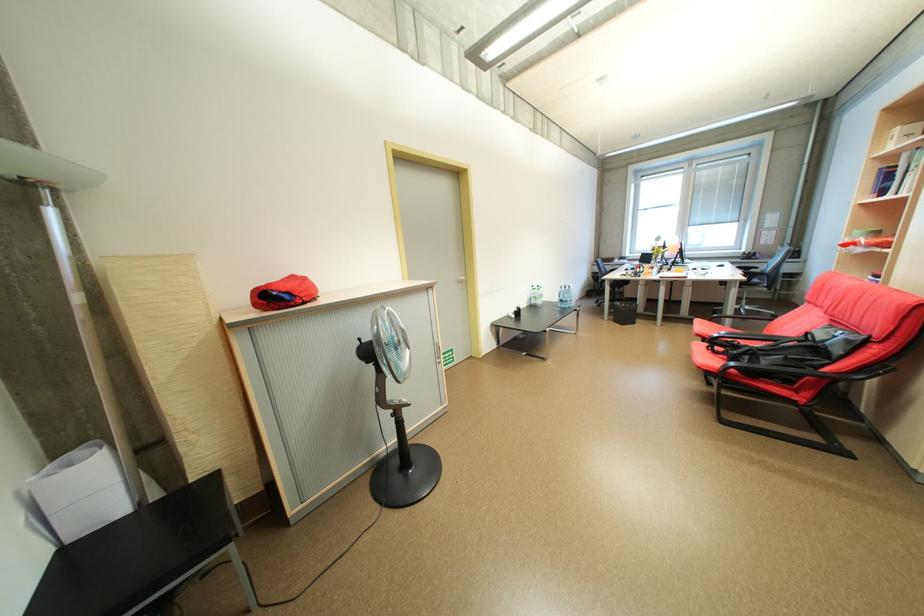
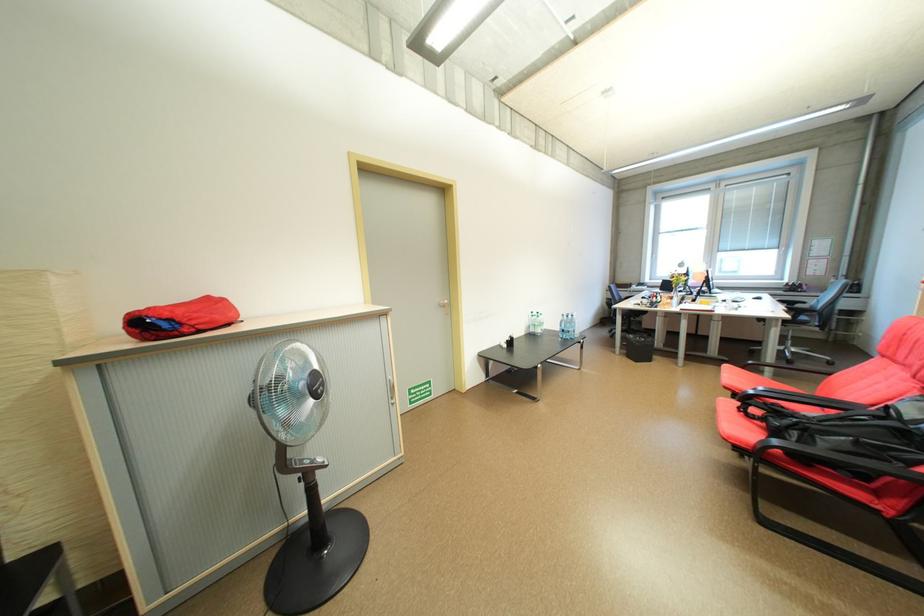
In the second image, find the point that corresponds to [541,302] in the first image.

(541, 331)